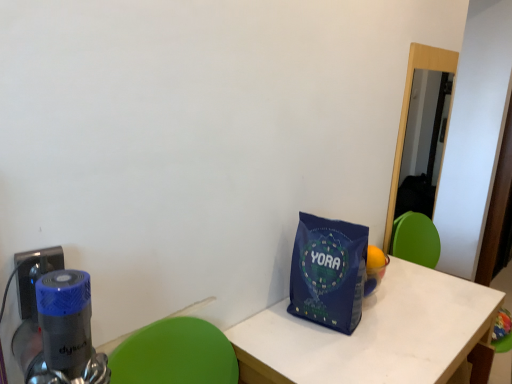
Question: Is blue fabric tote bag at lower right wider than blue plastic electric outlet at lower left?

Choices:
 (A) no
 (B) yes

Answer: (B)

Question: Is blue fabric tote bag at lower right positioned in front of blue plastic electric outlet at lower left?

Choices:
 (A) yes
 (B) no

Answer: (B)

Question: From a real-world perspective, is blue fabric tote bag at lower right positioned over blue plastic electric outlet at lower left based on gravity?

Choices:
 (A) no
 (B) yes

Answer: (A)

Question: From the image's perspective, is blue fabric tote bag at lower right above blue plastic electric outlet at lower left?

Choices:
 (A) yes
 (B) no

Answer: (B)

Question: Is blue fabric tote bag at lower right directly adjacent to blue plastic electric outlet at lower left?

Choices:
 (A) no
 (B) yes

Answer: (A)

Question: Considering their positions, is blue fabric tote bag at lower right located in front of or behind blue plastic electric outlet at lower left?

Choices:
 (A) front
 (B) behind

Answer: (B)

Question: Is blue fabric tote bag at lower right bigger or smaller than blue plastic electric outlet at lower left?

Choices:
 (A) big
 (B) small

Answer: (A)

Question: From a real-world perspective, relative to blue plastic electric outlet at lower left, is blue fabric tote bag at lower right vertically above or below?

Choices:
 (A) above
 (B) below

Answer: (B)

Question: Would you say blue fabric tote bag at lower right is to the left or to the right of blue plastic electric outlet at lower left in the picture?

Choices:
 (A) right
 (B) left

Answer: (A)

Question: Which is correct: white matte table at center is inside blue fabric tote bag at lower right, or outside of it?

Choices:
 (A) outside
 (B) inside

Answer: (A)

Question: From a real-world perspective, is white matte table at center physically located above or below blue fabric tote bag at lower right?

Choices:
 (A) above
 (B) below

Answer: (B)

Question: Would you say white matte table at center is to the left or to the right of blue fabric tote bag at lower right in the picture?

Choices:
 (A) right
 (B) left

Answer: (A)

Question: From the image's perspective, is white matte table at center above or below blue fabric tote bag at lower right?

Choices:
 (A) above
 (B) below

Answer: (B)

Question: In the image, is white matte table at center on the left side or the right side of blue plastic electric outlet at lower left?

Choices:
 (A) left
 (B) right

Answer: (B)

Question: Looking at the image, does white matte table at center seem bigger or smaller compared to blue plastic electric outlet at lower left?

Choices:
 (A) big
 (B) small

Answer: (A)